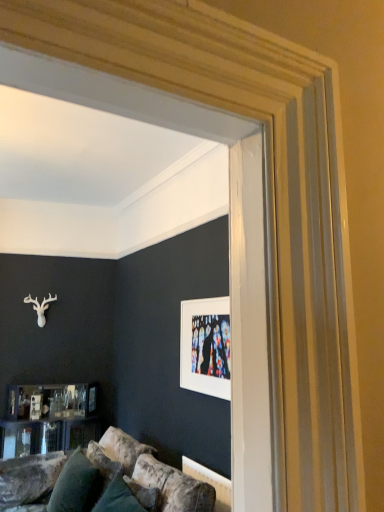
Question: In terms of width, does white matte picture frame at upper center look wider or thinner when compared to velvety green pillow at lower left?

Choices:
 (A) thin
 (B) wide

Answer: (A)

Question: Looking at the image, does white matte picture frame at upper center seem bigger or smaller compared to velvety green pillow at lower left?

Choices:
 (A) small
 (B) big

Answer: (A)

Question: Considering their positions, is white matte picture frame at upper center located in front of or behind velvety green pillow at lower left?

Choices:
 (A) behind
 (B) front

Answer: (B)

Question: Does point tap(84, 494) appear closer or farther from the camera than point tap(198, 373)?

Choices:
 (A) farther
 (B) closer

Answer: (B)

Question: Considering their positions, is velvety green pillow at lower left located in front of or behind white matte picture frame at upper center?

Choices:
 (A) behind
 (B) front

Answer: (A)

Question: From the image's perspective, is velvety green pillow at lower left located above or below white matte picture frame at upper center?

Choices:
 (A) above
 (B) below

Answer: (B)

Question: Is velvety green pillow at lower left taller or shorter than white matte picture frame at upper center?

Choices:
 (A) short
 (B) tall

Answer: (A)